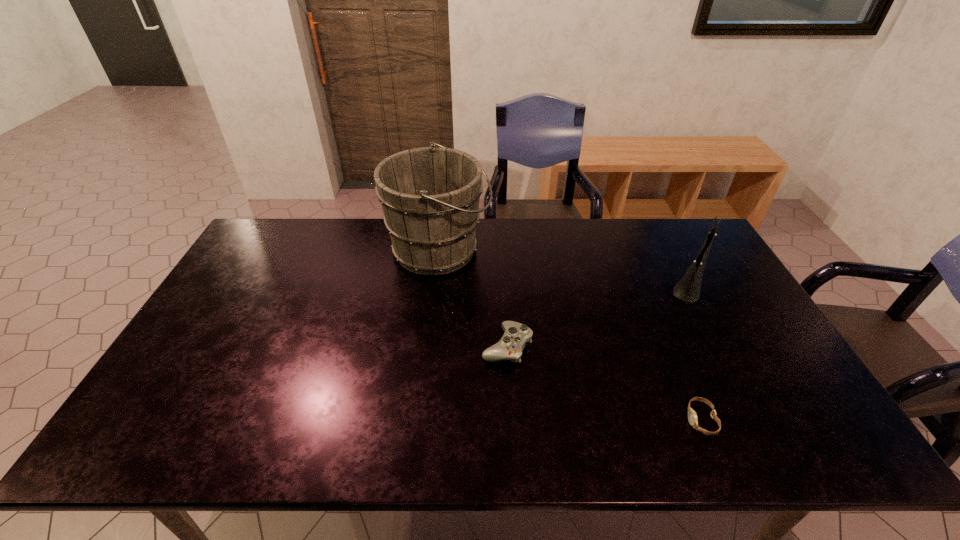
Locate an element on the screen. The image size is (960, 540). the tallest object is located at coordinates (430, 196).

The height and width of the screenshot is (540, 960). I want to click on shoulder bag, so click(688, 288).

The height and width of the screenshot is (540, 960). Find the location of `the rightmost object`. the rightmost object is located at coordinates (688, 288).

Where is `the third tallest object`? The width and height of the screenshot is (960, 540). the third tallest object is located at coordinates (510, 346).

Find the location of a particular element. The height and width of the screenshot is (540, 960). control is located at coordinates (510, 346).

At what (x,y) coordinates should I click in order to perform the action: click on watch. Please return your answer as a coordinate pair (x, y). The width and height of the screenshot is (960, 540). Looking at the image, I should click on (692, 415).

What are the coordinates of `the nearest object` in the screenshot? It's located at (692, 415).

Locate an element on the screen. This screenshot has width=960, height=540. free space located 0.300m on the handle side of the tallest object is located at coordinates (578, 250).

What are the coordinates of `free space located 0.110m on the back of the second tallest object` in the screenshot? It's located at (669, 246).

You are a GUI agent. You are given a task and a screenshot of the screen. Output one action in this format:
    pyautogui.click(x=<x>, y=<y>)
    Task: Click on the free space located on the left of the third tallest object
    This screenshot has height=540, width=960.
    Given the screenshot: What is the action you would take?
    pyautogui.click(x=442, y=346)